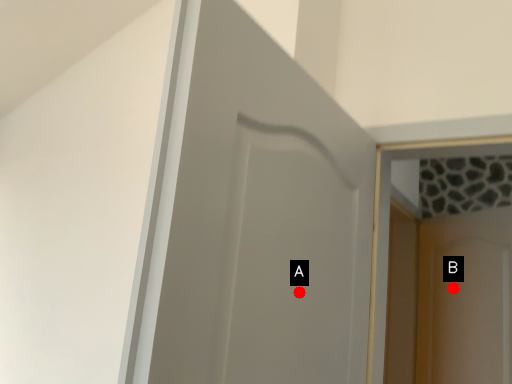
Question: Two points are circled on the image, labeled by A and B beside each circle. Which point is farther from the camera taking this photo?

Choices:
 (A) A is further
 (B) B is further

Answer: (B)